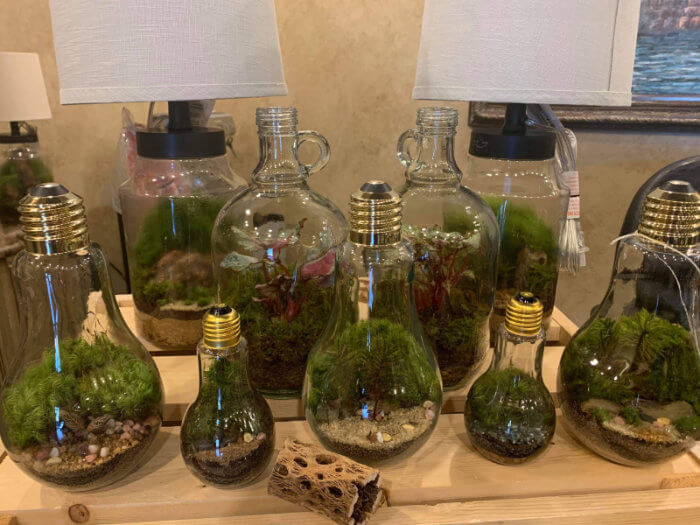
The image size is (700, 525). Find the location of `picture frame`. picture frame is located at coordinates (668, 112).